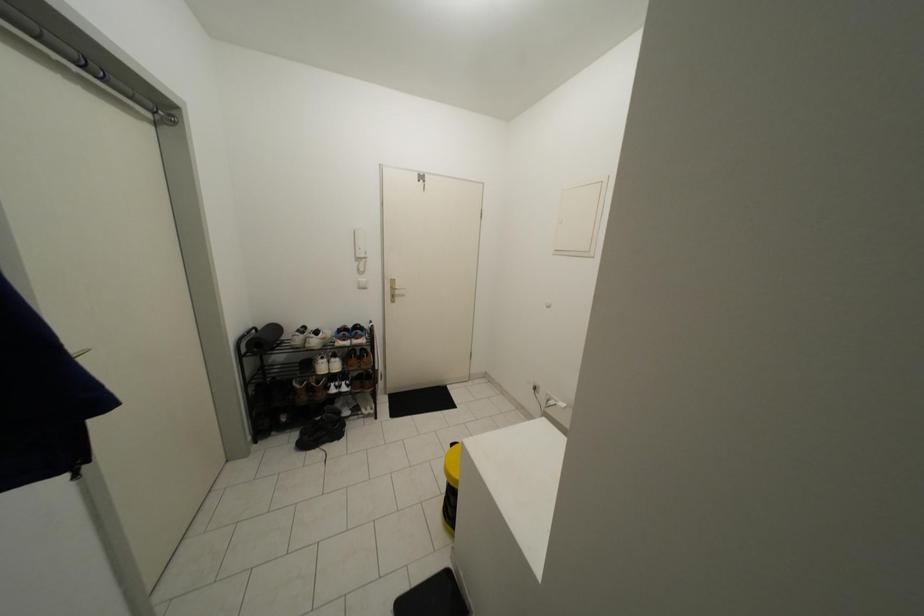
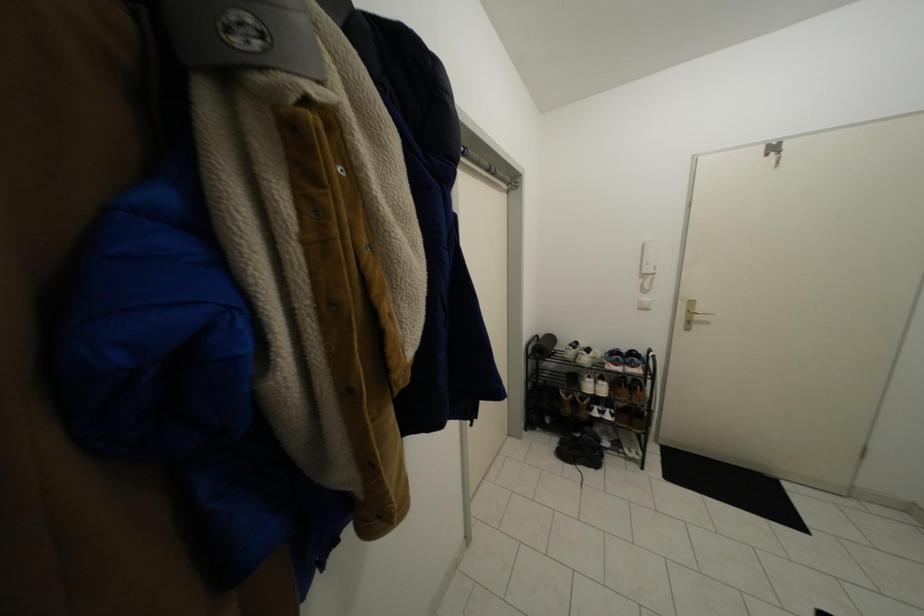
Question: The images are taken continuously from a first-person perspective. In which direction is your viewpoint rotating?

Choices:
 (A) Left
 (B) Right
 (C) Up
 (D) Down

Answer: (A)